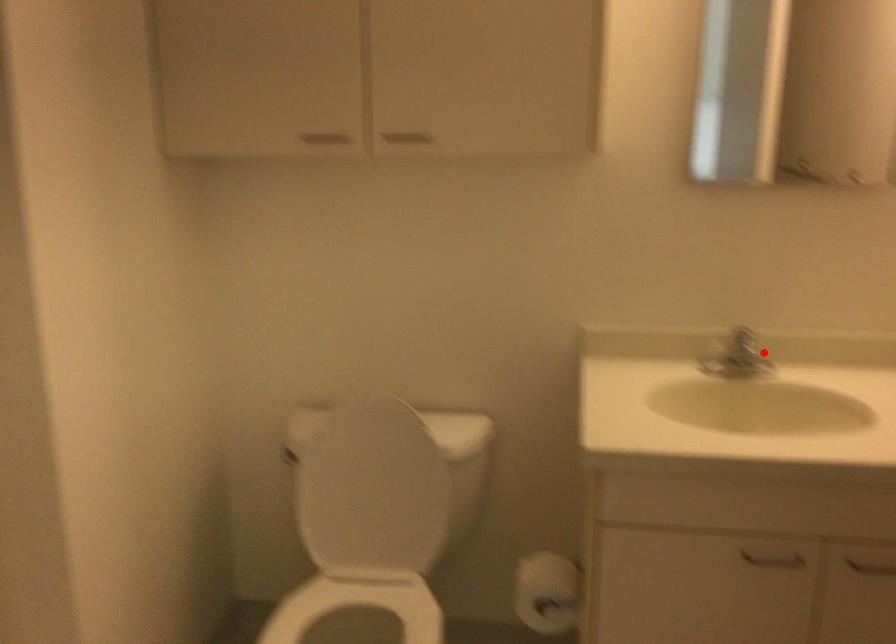
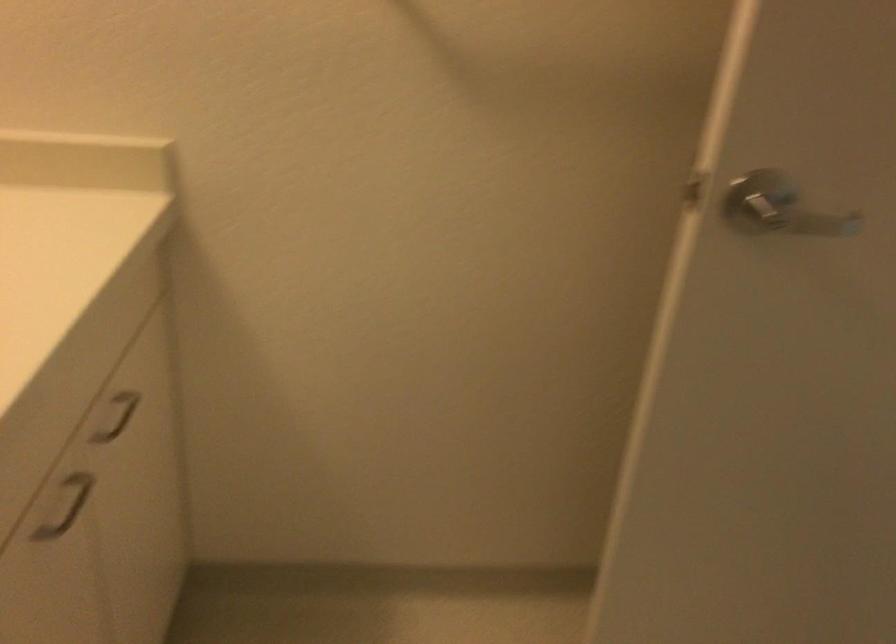
Locate, in the second image, the point that corresponds to the highlighted location in the first image.

(64, 507)